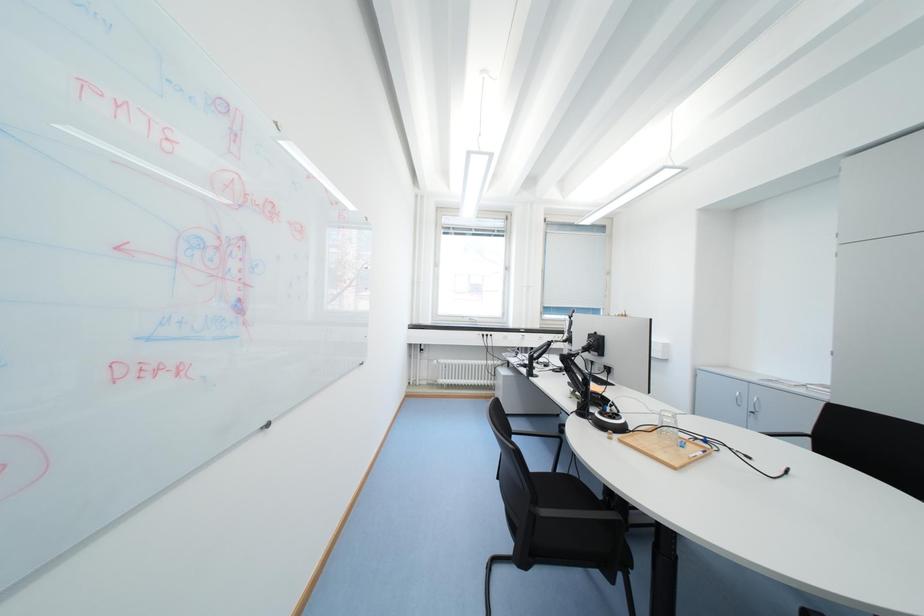
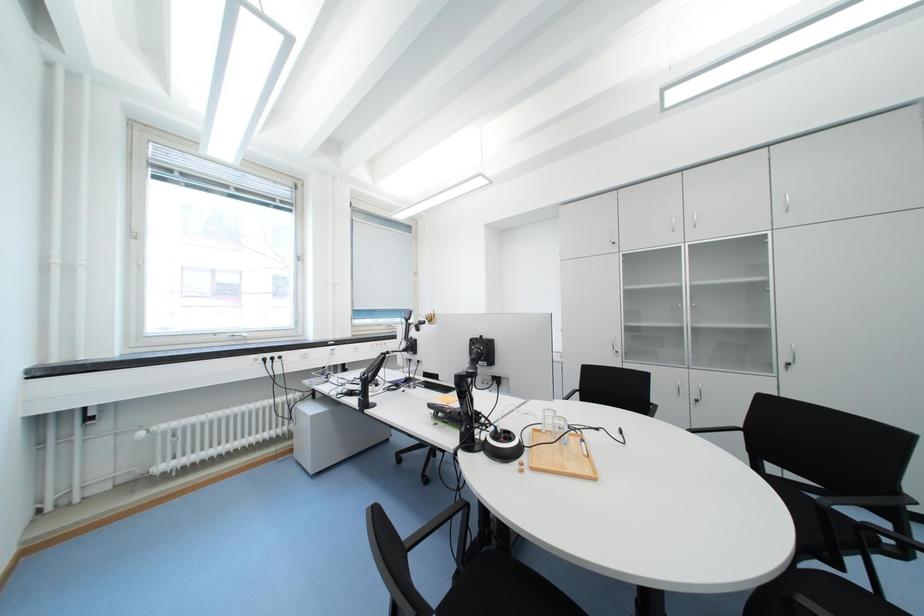
Question: Based on the continuous images, in which direction is the camera rotating? Reply with the corresponding letter.

Choices:
 (A) Left
 (B) Right
 (C) Up
 (D) Down

Answer: (B)